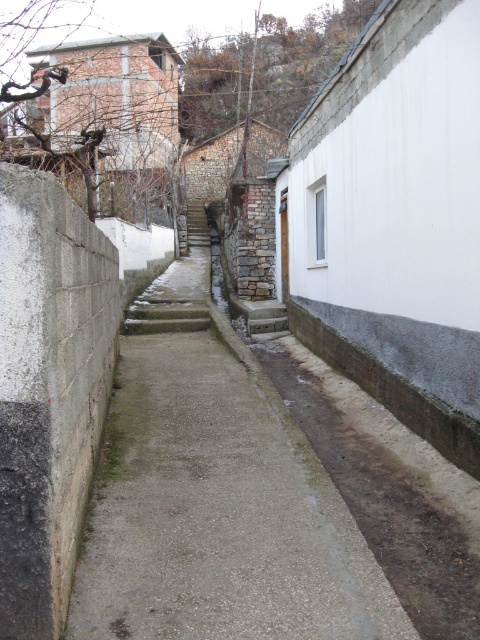
Is gray concrete path at center taller than stone textured stairs at center?

No, gray concrete path at center is not taller than stone textured stairs at center.

Is gray concrete path at center to the left of stone textured stairs at center from the viewer's perspective?

No, gray concrete path at center is not to the left of stone textured stairs at center.

Is point (157, 524) positioned before point (204, 208)?

Yes, point (157, 524) is in front of point (204, 208).

I want to click on gray concrete path at center, so 215,496.